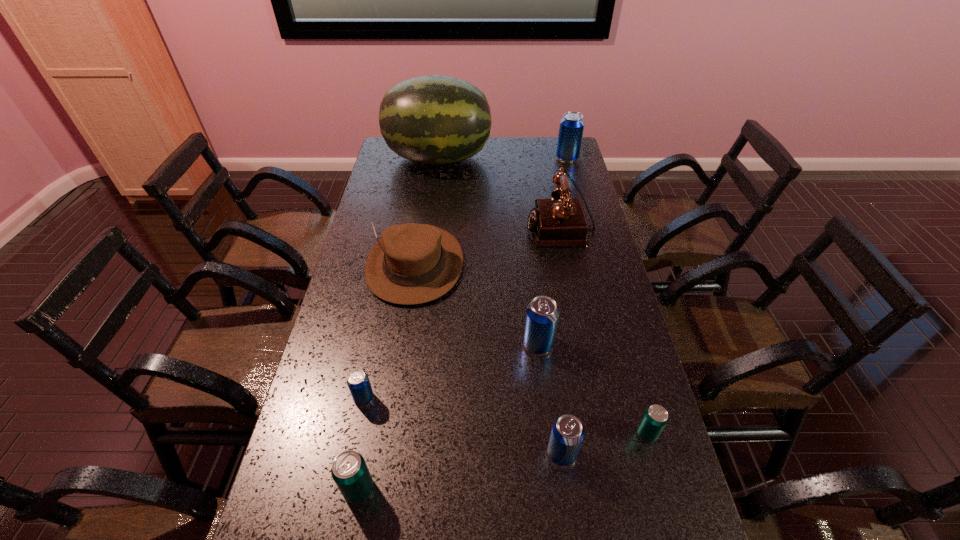
This screenshot has width=960, height=540. What are the coordinates of `the nearest blue beer can` in the screenshot? It's located at (567, 433).

Locate an element on the screen. the sixth farthest object is located at coordinates (358, 382).

Locate an element on the screen. the smallest blue beer can is located at coordinates (358, 382).

Where is `the right teal beer can`? Image resolution: width=960 pixels, height=540 pixels. the right teal beer can is located at coordinates (655, 418).

You are a GUI agent. You are given a task and a screenshot of the screen. Output one action in this format:
    pyautogui.click(x=<x>, y=<y>)
    Task: Click on the farther teal beer can
    Image resolution: width=960 pixels, height=540 pixels.
    Given the screenshot: What is the action you would take?
    pyautogui.click(x=655, y=418)

Locate an element on the screen. vacant position located 0.260m on the front of the tallest object is located at coordinates (431, 219).

I want to click on free spot located 0.200m on the dial of the brown telephone, so click(x=472, y=227).

I want to click on vacant area situated 0.160m on the dial of the brown telephone, so click(x=483, y=227).

The image size is (960, 540). In order to click on free point located on the dial of the brown telephone in this screenshot , I will do `click(464, 227)`.

Image resolution: width=960 pixels, height=540 pixels. In order to click on free region located 0.300m on the left of the tallest beer can in this screenshot , I will do `click(488, 158)`.